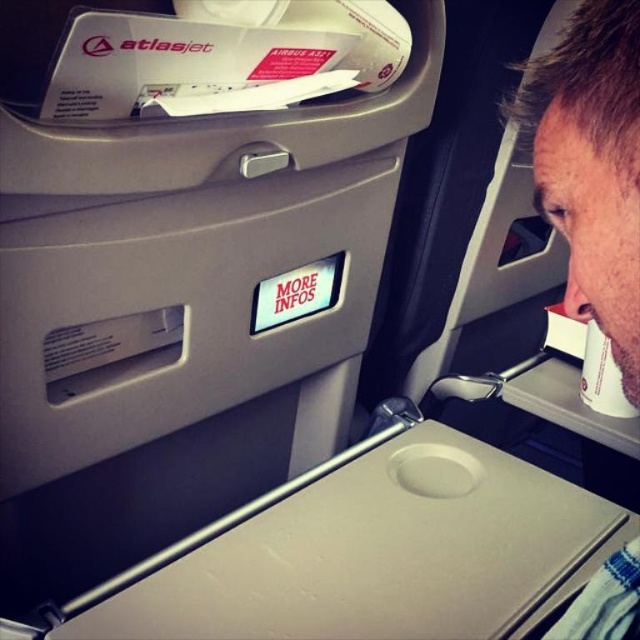
You are a flight attendant checking the cabin. You need to place a new cup holder between the beige fabric headrest at upper right and the white paper cup at right. Based on their sizes, which object should the cup holder be placed closer to?

The beige fabric headrest at upper right has a larger size compared to the white paper cup at right, so the cup holder should be placed closer to the beige fabric headrest at upper right to accommodate its size.

In the airplane cabin scene, there is a beige fabric headrest at upper right and a light gray tray table extended forward. Which object is closer to the point with coordinates [593,166]?

The beige fabric headrest at upper right is located at point [593,166], so it is exactly at that coordinate.

You are seated in the airplane cabin and notice two items near your seat. The beige fabric headrest at upper right and the white paper cup at right. Which item is taller?

The beige fabric headrest at upper right is taller than the white paper cup at right.